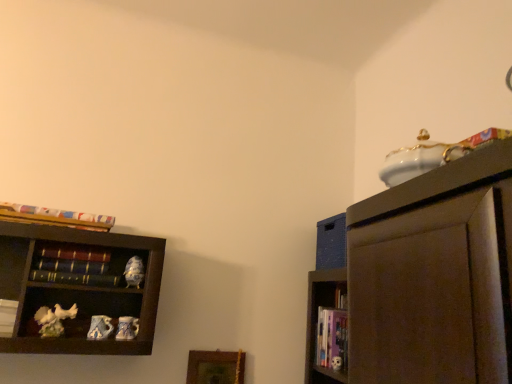
Find the location of a particular element. This screenshot has width=512, height=384. white matte book at left, which ranks as the 5th book in right-to-left order is located at coordinates (7, 316).

What do you see at coordinates (7, 316) in the screenshot? I see `white matte book at left, the second book in the bottom-to-top sequence` at bounding box center [7, 316].

This screenshot has width=512, height=384. What are the coordinates of `porcelain mug at lower left, which is counted as the 3th toy, starting from the top` in the screenshot? It's located at (127, 328).

How much space does porcelain mug at lower left, which is counted as the 3th toy, starting from the top, occupy vertically?

porcelain mug at lower left, which is counted as the 3th toy, starting from the top, is 9.86 centimeters tall.

At what (x,y) coordinates should I click in order to perform the action: click on wooden picture frame at lower center. Please return your answer as a coordinate pair (x, y). This screenshot has height=384, width=512. Looking at the image, I should click on (215, 367).

How much space does porcelain figurine at left, which ranks as the first toy in top-to-bottom order, occupy horizontally?

3.08 inches.

The image size is (512, 384). What do you see at coordinates (55, 217) in the screenshot? I see `multicolored paper at upper left, positioned as the 5th book in bottom-to-top order` at bounding box center [55, 217].

Where is `matte ceramic bird at lower left, positioned as the second toy in top-to-bottom order`? matte ceramic bird at lower left, positioned as the second toy in top-to-bottom order is located at coordinates (100, 328).

Locate an element on the screen. The width and height of the screenshot is (512, 384). white matte book at left, which ranks as the 5th book in right-to-left order is located at coordinates (7, 316).

Is matte ceramic bird at lower left, positioned as the second toy in top-to-bottom order, in front of hardcover book at lower right, the 1th book viewed from the right?

Yes, matte ceramic bird at lower left, positioned as the second toy in top-to-bottom order, is closer to the camera.

Would you say matte ceramic bird at lower left, which ranks as the second toy in bottom-to-top order, is a long distance from hardcover book at lower right, which appears as the 1th book when ordered from the bottom?

No, matte ceramic bird at lower left, which ranks as the second toy in bottom-to-top order, is in close proximity to hardcover book at lower right, which appears as the 1th book when ordered from the bottom.

Considering the relative sizes of matte ceramic bird at lower left, which ranks as the second toy in bottom-to-top order, and hardcover book at lower right, the fifth book positioned from the left, in the image provided, is matte ceramic bird at lower left, which ranks as the second toy in bottom-to-top order, taller than hardcover book at lower right, the fifth book positioned from the left,?

In fact, matte ceramic bird at lower left, which ranks as the second toy in bottom-to-top order, may be shorter than hardcover book at lower right, the fifth book positioned from the left.

Locate an element on the screen. toy that is the 2nd one when counting upward from the hardcover book at lower right, the 1th book viewed from the right (from the image's perspective) is located at coordinates (100, 328).

Looking at this image, from a real-world perspective, between wooden picture frame at lower center and porcelain mug at lower left, which is counted as the 3th toy, starting from the top, who is vertically higher?

From a 3D spatial view, porcelain mug at lower left, which is counted as the 3th toy, starting from the top, is above.

Consider the image. Is wooden picture frame at lower center facing towards porcelain mug at lower left, which is counted as the 3th toy, starting from the top?

No, wooden picture frame at lower center is not turned towards porcelain mug at lower left, which is counted as the 3th toy, starting from the top.

Looking at the image, does wooden picture frame at lower center seem bigger or smaller compared to porcelain mug at lower left, which is counted as the 3th toy, starting from the top?

wooden picture frame at lower center is bigger than porcelain mug at lower left, which is counted as the 3th toy, starting from the top.

Which is farther from the camera, [57,278] or [134,284]?

Point [134,284]

Is hardcover books at left, marked as the 2th book in a top-to-bottom arrangement, positioned before porcelain figurine at left, which ranks as the 3th toy in bottom-to-top order?

Yes, it is in front of porcelain figurine at left, which ranks as the 3th toy in bottom-to-top order.

Is hardcover books at left, which appears as the fourth book when ordered from the bottom, oriented away from porcelain figurine at left, which ranks as the 3th toy in bottom-to-top order?

No, hardcover books at left, which appears as the fourth book when ordered from the bottom, is not facing away from porcelain figurine at left, which ranks as the 3th toy in bottom-to-top order.

Can you confirm if hardcover books at left, which ranks as the third book in right-to-left order, is wider than porcelain figurine at left, which ranks as the first toy in top-to-bottom order?

Indeed, hardcover books at left, which ranks as the third book in right-to-left order, has a greater width compared to porcelain figurine at left, which ranks as the first toy in top-to-bottom order.

Is point (139, 277) closer or farther from the camera than point (40, 272)?

Point (139, 277) is farther from the camera than point (40, 272).

In the image, is porcelain figurine at left, which ranks as the 3th toy in bottom-to-top order, positioned in front of or behind hardcover book at left, arranged as the 2th book when viewed from the right?

porcelain figurine at left, which ranks as the 3th toy in bottom-to-top order, is behind hardcover book at left, arranged as the 2th book when viewed from the right.

Consider the image. Considering the sizes of porcelain figurine at left, which ranks as the 3th toy in bottom-to-top order, and hardcover book at left, arranged as the 2th book when viewed from the right, in the image, is porcelain figurine at left, which ranks as the 3th toy in bottom-to-top order, taller or shorter than hardcover book at left, arranged as the 2th book when viewed from the right,?

Clearly, porcelain figurine at left, which ranks as the 3th toy in bottom-to-top order, is taller compared to hardcover book at left, arranged as the 2th book when viewed from the right.

From the image's perspective, is porcelain figurine at left, which ranks as the first toy in top-to-bottom order, on hardcover book at left, arranged as the 2th book when viewed from the right?

Yes, from the image's perspective, porcelain figurine at left, which ranks as the first toy in top-to-bottom order, is above hardcover book at left, arranged as the 2th book when viewed from the right.

Is hardcover book at left, which ranks as the 4th book in left-to-right order, in front of or behind multicolored paper at upper left, arranged as the 1th book when viewed from the top, in the image?

Clearly, hardcover book at left, which ranks as the 4th book in left-to-right order, is behind multicolored paper at upper left, arranged as the 1th book when viewed from the top.

Is point (78, 276) positioned behind point (70, 223)?

That is True.

Is porcelain mug at lower left, which is counted as the 3th toy, starting from the top, next to multicolored paper at upper left, marked as the fourth book in a right-to-left arrangement?

No, porcelain mug at lower left, which is counted as the 3th toy, starting from the top, is not beside multicolored paper at upper left, marked as the fourth book in a right-to-left arrangement.

From the image's perspective, which is above, porcelain mug at lower left, which is counted as the 3th toy, starting from the top, or multicolored paper at upper left, arranged as the 1th book when viewed from the top?

multicolored paper at upper left, arranged as the 1th book when viewed from the top, from the image's perspective.

From a real-world perspective, is porcelain mug at lower left, which is counted as the 3th toy, starting from the top, on multicolored paper at upper left, marked as the fourth book in a right-to-left arrangement?

Incorrect, from a real-world perspective, porcelain mug at lower left, which is counted as the 3th toy, starting from the top, is lower than multicolored paper at upper left, marked as the fourth book in a right-to-left arrangement.

Can you confirm if porcelain mug at lower left, which is counted as the 3th toy, starting from the top, is shorter than hardcover book at lower right, the 1th book viewed from the right?

Yes.

How much distance is there between porcelain mug at lower left, which is counted as the first toy, starting from the bottom, and hardcover book at lower right, which appears as the 1th book when ordered from the bottom?

porcelain mug at lower left, which is counted as the first toy, starting from the bottom, is 32.02 inches away from hardcover book at lower right, which appears as the 1th book when ordered from the bottom.

Is porcelain mug at lower left, which is counted as the first toy, starting from the bottom, bigger than hardcover book at lower right, marked as the 5th book in a top-to-bottom arrangement?

Answer: Incorrect, porcelain mug at lower left, which is counted as the first toy, starting from the bottom, is not larger than hardcover book at lower right, marked as the 5th book in a top-to-bottom arrangement.

At what (x,y) coordinates should I click in order to perform the action: click on toy that is the 1st object directly below the hardcover book at lower right, the 1th book viewed from the right (from a real-world perspective). Please return your answer as a coordinate pair (x, y). This screenshot has width=512, height=384. Looking at the image, I should click on (100, 328).

What are the coordinates of `picture frame on the right of the porcelain mug at lower left, which is counted as the first toy, starting from the bottom` in the screenshot? It's located at (215, 367).

Considering their positions, is wooden picture frame at lower center positioned closer to hardcover books at left, which appears as the fourth book when ordered from the bottom, than porcelain figurine at left, which ranks as the 3th toy in bottom-to-top order?

porcelain figurine at left, which ranks as the 3th toy in bottom-to-top order, lies closer to hardcover books at left, which appears as the fourth book when ordered from the bottom, than the other object.

From the image, which object appears to be farther from hardcover book at left, the third book from the top, white matte book at left, which ranks as the 4th book in top-to-bottom order, or porcelain figurine at left, which ranks as the first toy in top-to-bottom order?

white matte book at left, which ranks as the 4th book in top-to-bottom order, lies further to hardcover book at left, the third book from the top, than the other object.

From the image, which object appears to be nearer to porcelain mug at lower left, which is counted as the first toy, starting from the bottom, matte ceramic bird at lower left, which ranks as the second toy in bottom-to-top order, or hardcover book at left, arranged as the 2th book when viewed from the right?

Based on the image, matte ceramic bird at lower left, which ranks as the second toy in bottom-to-top order, appears to be nearer to porcelain mug at lower left, which is counted as the first toy, starting from the bottom.

Based on their spatial positions, is porcelain mug at lower left, which is counted as the first toy, starting from the bottom, or matte ceramic bird at lower left, which ranks as the second toy in bottom-to-top order, further from multicolored paper at upper left, marked as the fourth book in a right-to-left arrangement?

Among the two, porcelain mug at lower left, which is counted as the first toy, starting from the bottom, is located further to multicolored paper at upper left, marked as the fourth book in a right-to-left arrangement.

Considering their positions, is porcelain figurine at left, which ranks as the first toy in top-to-bottom order, positioned closer to hardcover book at lower right, marked as the 5th book in a top-to-bottom arrangement, than white matte book at left, which ranks as the 4th book in top-to-bottom order?

porcelain figurine at left, which ranks as the first toy in top-to-bottom order, is positioned closer to the anchor hardcover book at lower right, marked as the 5th book in a top-to-bottom arrangement.

Looking at the image, which one is located closer to multicolored paper at upper left, the 2th book positioned from the left, matte ceramic bird at lower left, which ranks as the second toy in bottom-to-top order, or wooden picture frame at lower center?

matte ceramic bird at lower left, which ranks as the second toy in bottom-to-top order, lies closer to multicolored paper at upper left, the 2th book positioned from the left, than the other object.

When comparing their distances from white matte book at left, which ranks as the 4th book in top-to-bottom order, does porcelain figurine at left, which ranks as the 3th toy in bottom-to-top order, or hardcover books at left, which ranks as the third book in right-to-left order, seem closer?

hardcover books at left, which ranks as the third book in right-to-left order.

When comparing their distances from multicolored paper at upper left, marked as the fourth book in a right-to-left arrangement, does porcelain mug at lower left, which is counted as the first toy, starting from the bottom, or porcelain figurine at left, which ranks as the 3th toy in bottom-to-top order, seem further?

porcelain mug at lower left, which is counted as the first toy, starting from the bottom.

Image resolution: width=512 pixels, height=384 pixels. Identify the location of toy that lies between matte ceramic bird at lower left, which ranks as the second toy in bottom-to-top order, and wooden picture frame at lower center from top to bottom. (127, 328).

Where is `toy between multicolored paper at upper left, positioned as the 5th book in bottom-to-top order, and matte ceramic bird at lower left, positioned as the second toy in top-to-bottom order, in the vertical direction`? This screenshot has height=384, width=512. toy between multicolored paper at upper left, positioned as the 5th book in bottom-to-top order, and matte ceramic bird at lower left, positioned as the second toy in top-to-bottom order, in the vertical direction is located at coordinates (134, 272).

Where is `picture frame situated between porcelain figurine at left, which ranks as the 3th toy in bottom-to-top order, and hardcover book at lower right, marked as the 5th book in a top-to-bottom arrangement, from left to right`? The height and width of the screenshot is (384, 512). picture frame situated between porcelain figurine at left, which ranks as the 3th toy in bottom-to-top order, and hardcover book at lower right, marked as the 5th book in a top-to-bottom arrangement, from left to right is located at coordinates (215, 367).

The image size is (512, 384). What are the coordinates of `picture frame situated between white matte book at left, marked as the 1th book in a left-to-right arrangement, and hardcover book at lower right, which appears as the 1th book when ordered from the bottom, from left to right` in the screenshot? It's located at (215, 367).